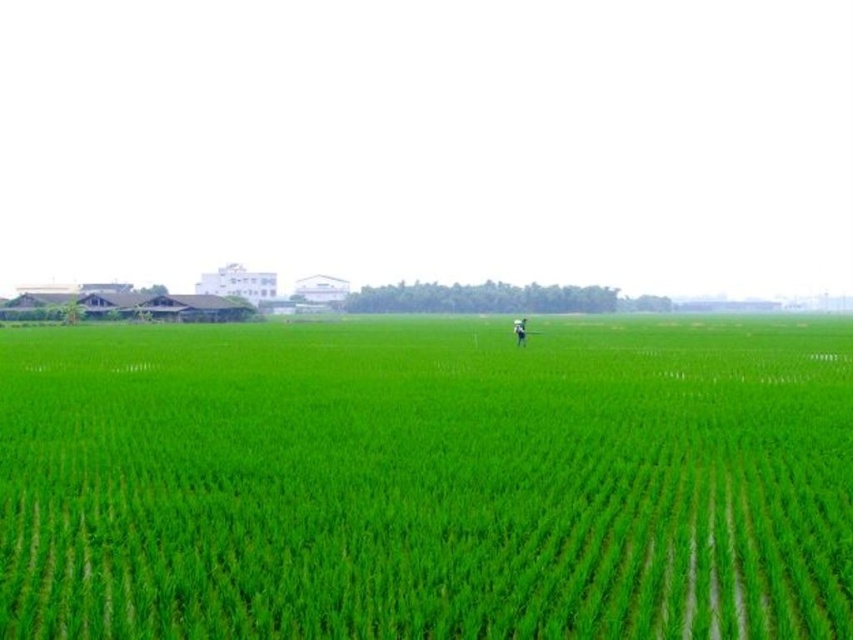
You are standing in the rice field and see the green grassy field at center and the light blue fabric person at center. Which object is located to the left of the other?

The green grassy field at center is located to the left of the light blue fabric person at center.